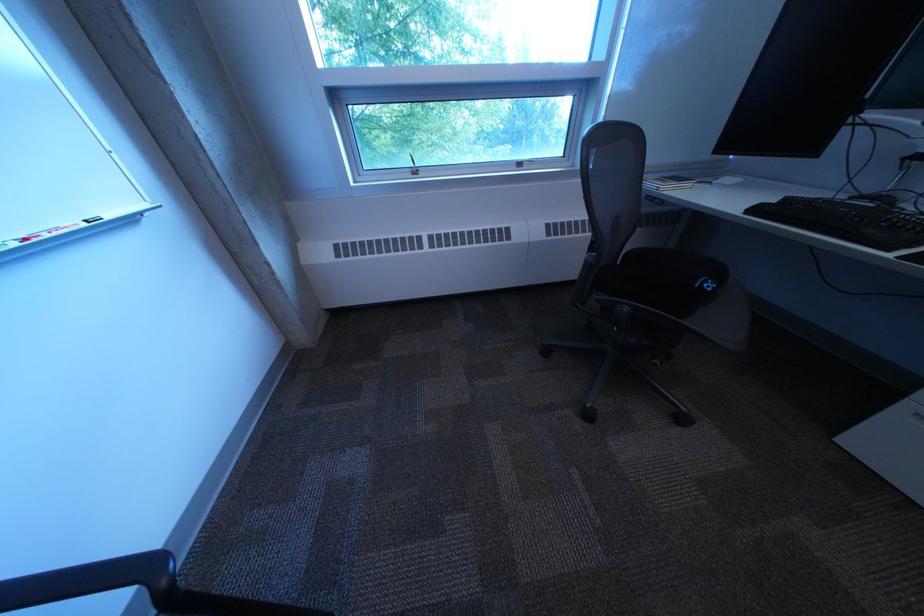
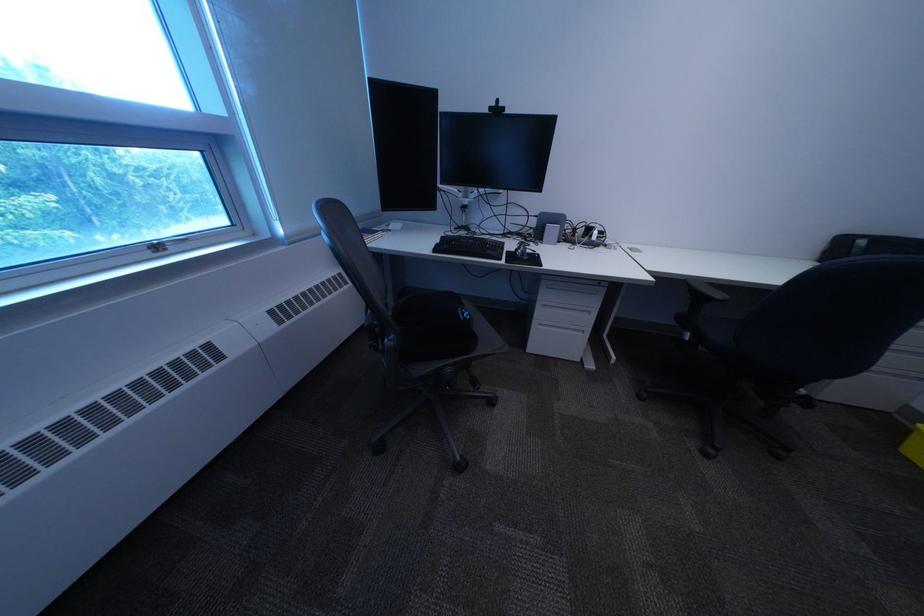
Find the pixel in the second image that matches point 767,213 in the first image.

(451, 252)